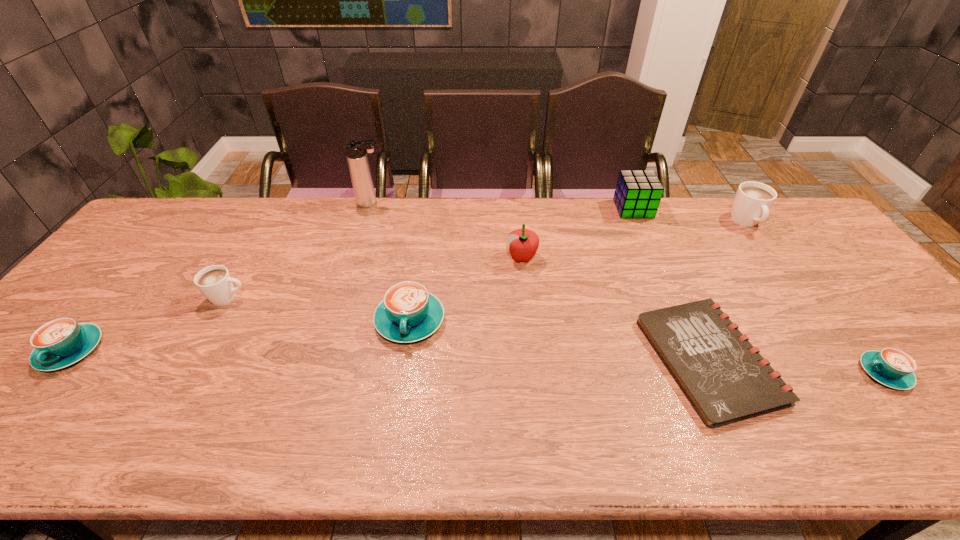
Point out which cappuccino is positioned as the fourth nearest to the fourth farthest object. Please provide its 2D coordinates. Your answer should be formatted as a tuple, i.e. [(x, y)], where the tuple contains the x and y coordinates of a point satisfying the conditions above.

[(891, 367)]

The width and height of the screenshot is (960, 540). What are the coordinates of `cappuccino that is the fifth nearest to the red cube` in the screenshot? It's located at (62, 342).

Select which turquoise cappuccino appears as the second closest to the thermos bottle. Please provide its 2D coordinates. Your answer should be formatted as a tuple, i.e. [(x, y)], where the tuple contains the x and y coordinates of a point satisfying the conditions above.

[(62, 342)]

Identify the location of turquoise cappuccino that can be found as the second closest to the bigger white cappuccino. (408, 313).

You are a GUI agent. You are given a task and a screenshot of the screen. Output one action in this format:
    pyautogui.click(x=<x>, y=<y>)
    Task: Click on the vacant space that satisfies the following two spatial constraints: 1. with the handle on the right side of the shortest object; 2. on the right side of the second turquoise cappuccino from left to right
    
    Given the screenshot: What is the action you would take?
    pyautogui.click(x=404, y=360)

Locate an element on the screen. vacant space that satisfies the following two spatial constraints: 1. on the handle side of the seventh object from right to left; 2. on the left side of the notebook is located at coordinates (324, 360).

At what (x,y) coordinates should I click in order to perform the action: click on vacant space that satisfies the following two spatial constraints: 1. with the handle on the side of the right white cappuccino; 2. with the handle on the side of the left white cappuccino. Please return your answer as a coordinate pair (x, y). The width and height of the screenshot is (960, 540). Looking at the image, I should click on (800, 298).

Where is `vacant point that satisfies the following two spatial constraints: 1. on the back side of the red cube; 2. on the right side of the apple`? vacant point that satisfies the following two spatial constraints: 1. on the back side of the red cube; 2. on the right side of the apple is located at coordinates (516, 209).

The image size is (960, 540). I want to click on free space that satisfies the following two spatial constraints: 1. on the handle side of the thermos bottle; 2. on the back side of the red cube, so click(x=370, y=209).

What are the coordinates of `free space that satisfies the following two spatial constraints: 1. on the back side of the fifth object from left to right; 2. on the handle side of the tallest object` in the screenshot? It's located at (516, 203).